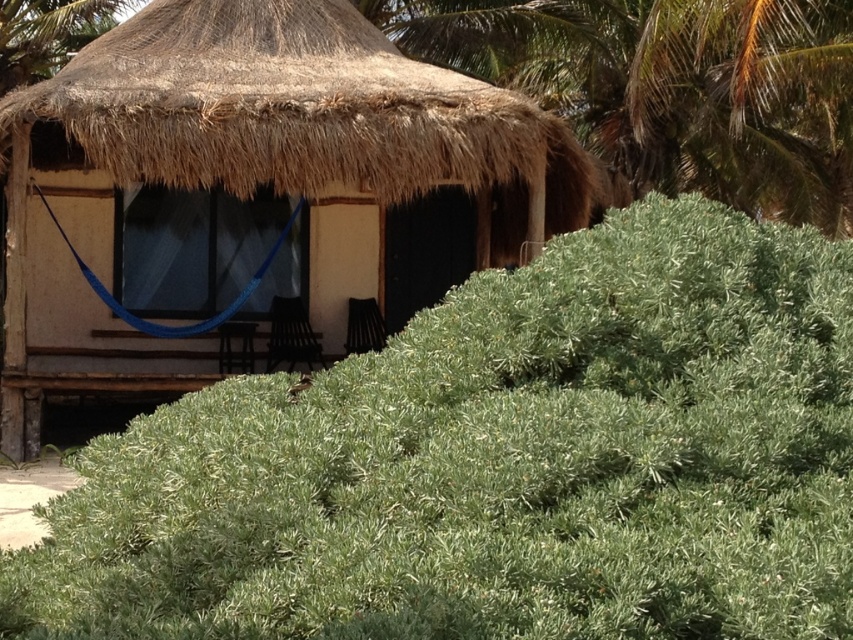
You are planning to install a solar panel on the thatched roof hut at center. The solar panel requires a clear space of at least 40 feet from any tall plants or trees to avoid shading. Based on the image, will the green leafy palm tree at upper right interfere with the solar panel installation?

The thatched roof hut at center and green leafy palm tree at upper right are 37.33 feet apart. Since the required distance is 40 feet, the green leafy palm tree at upper right is closer than the required distance, so it will interfere with the solar panel installation.